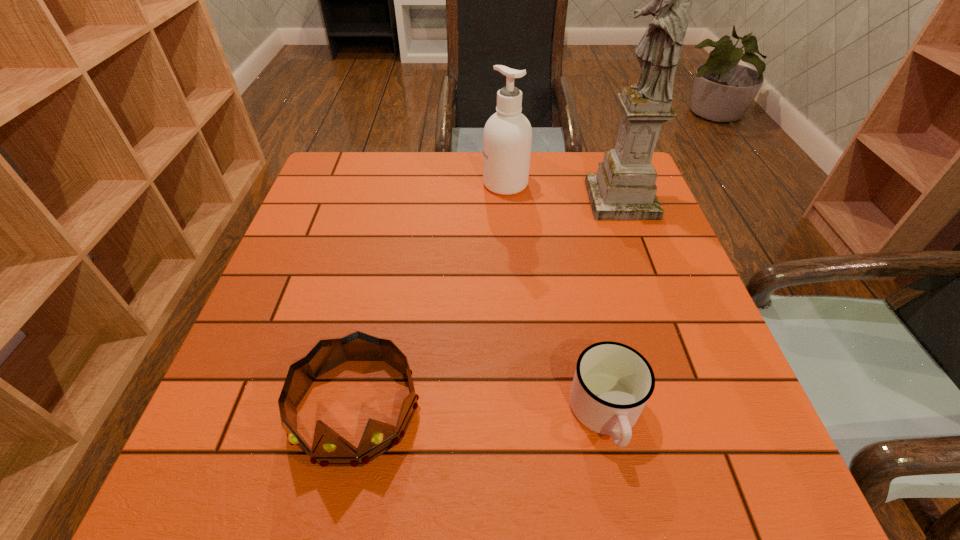
What are the coordinates of `object at the near left corner` in the screenshot? It's located at (329, 449).

What are the coordinates of `object situated at the far right corner` in the screenshot? It's located at (624, 188).

Find the location of a particular element. vacant space at the far edge of the desktop is located at coordinates (443, 171).

In the image, there is a desktop. Identify the location of vacant space at the near edge. (540, 494).

Locate an element on the screen. The image size is (960, 540). free region at the left edge of the desktop is located at coordinates (255, 333).

The width and height of the screenshot is (960, 540). What are the coordinates of `vacant space at the right edge of the desktop` in the screenshot? It's located at (612, 225).

Identify the location of free spot at the far left corner of the desktop. (331, 168).

In the image, there is a desktop. Identify the location of vacant space at the near left corner. The height and width of the screenshot is (540, 960). (243, 472).

Identify the location of free space at the far right corner of the desktop. (601, 156).

The width and height of the screenshot is (960, 540). What are the coordinates of `free space between the tiara and the tallest object` in the screenshot? It's located at tap(488, 305).